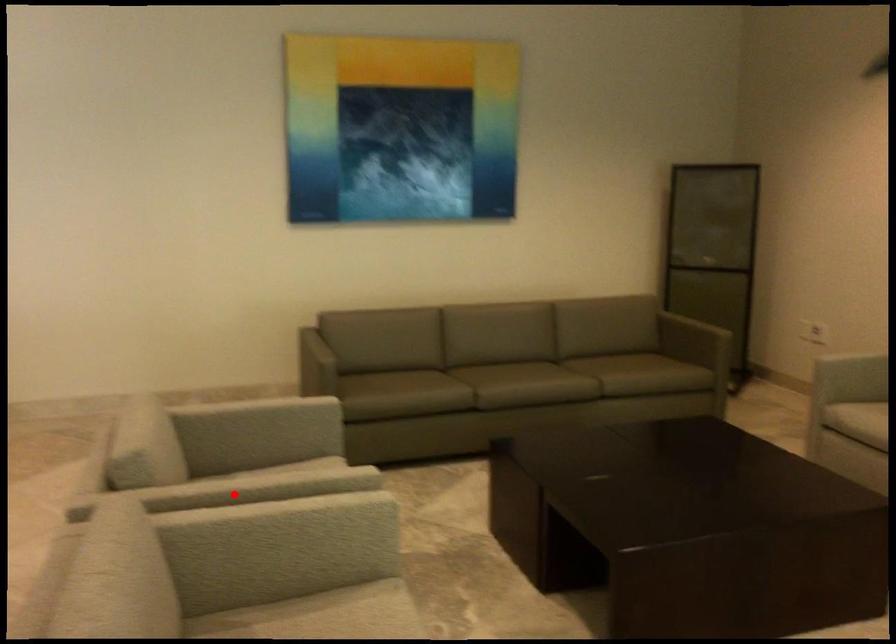
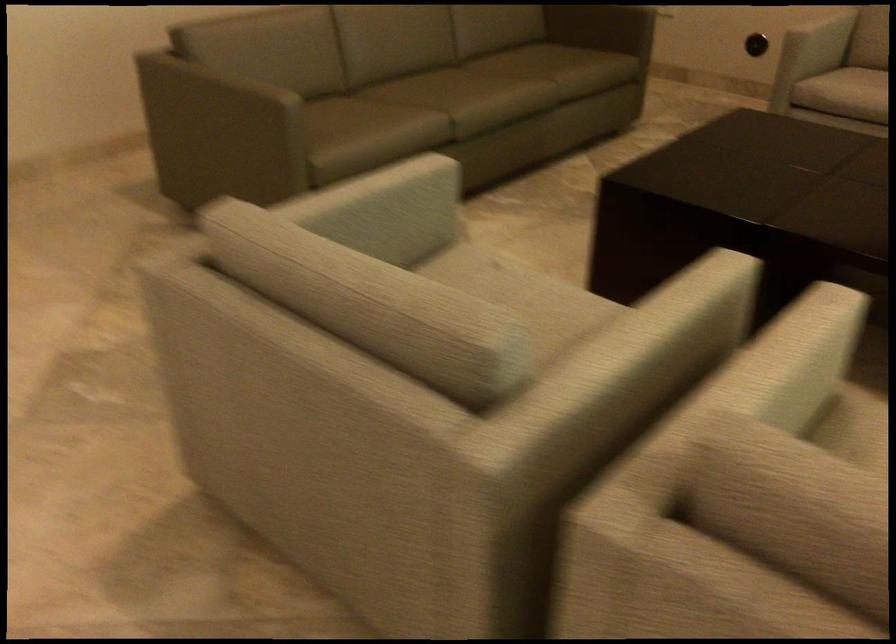
Question: I am providing you with two images of the same scene from different viewpoints. Given a red point in image1, look at the same physical point in image2. Is it:

Choices:
 (A) Closer to the viewpoint
 (B) Farther from the viewpoint

Answer: (A)